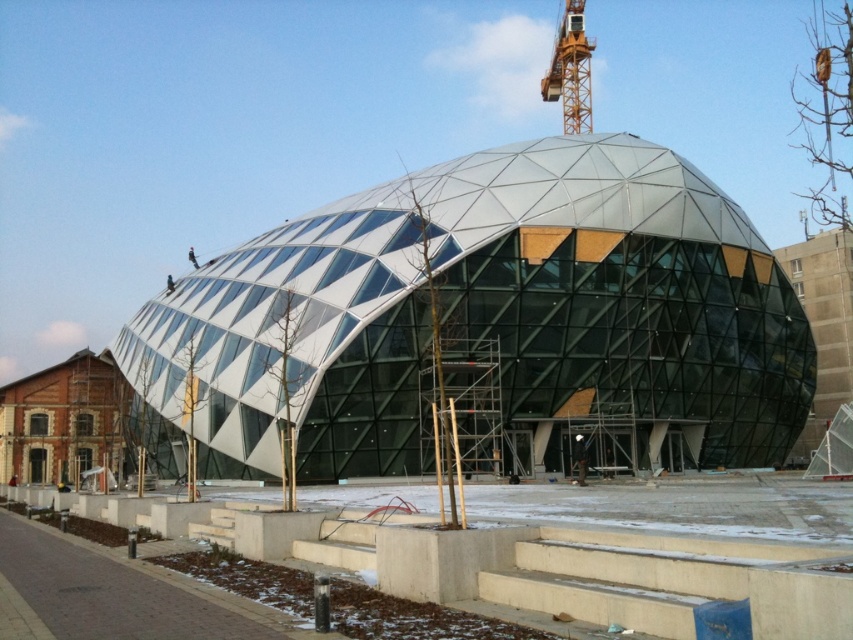
Question: Which object is closer to the camera taking this photo?

Choices:
 (A) concrete steps at center
 (B) orange metallic crane at upper center

Answer: (A)

Question: In this image, where is metallic glass dome at center located relative to orange metallic crane at upper center?

Choices:
 (A) above
 (B) below

Answer: (B)

Question: Where is metallic glass dome at center located in relation to orange metallic crane at upper center in the image?

Choices:
 (A) above
 (B) below

Answer: (B)

Question: Is concrete steps at center bigger than orange metallic crane at upper center?

Choices:
 (A) no
 (B) yes

Answer: (A)

Question: Which object is positioned closest to the concrete steps at center?

Choices:
 (A) orange metallic crane at upper center
 (B) metallic glass dome at center

Answer: (B)

Question: Which point is farther to the camera?

Choices:
 (A) concrete steps at center
 (B) orange metallic crane at upper center

Answer: (B)